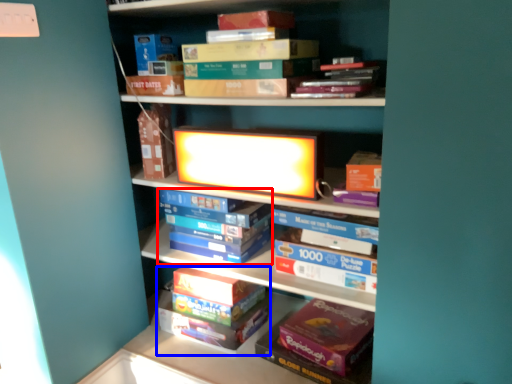
Question: Which object is further to the camera taking this photo, book (highlighted by a red box) or book (highlighted by a blue box)?

Choices:
 (A) book
 (B) book

Answer: (B)